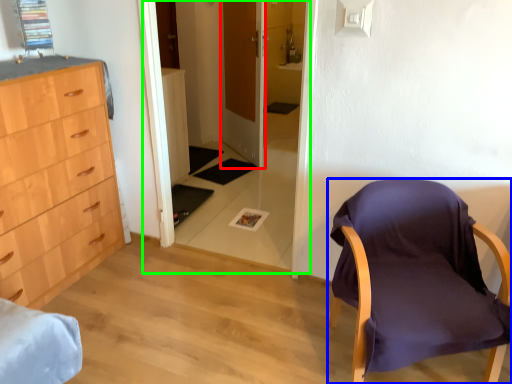
Question: Based on their relative distances, which object is nearer to door (highlighted by a red box)? Choose from chair (highlighted by a blue box) and glass door (highlighted by a green box).

Choices:
 (A) chair
 (B) glass door

Answer: (B)